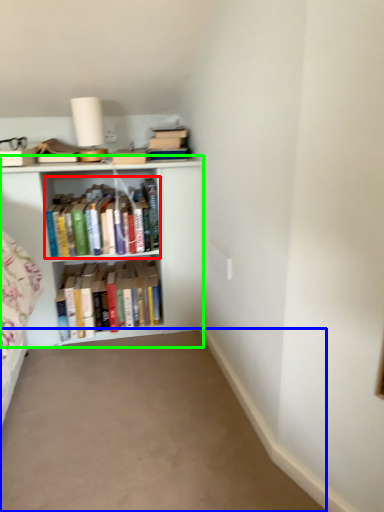
Question: Which object is positioned farthest from book (highlighted by a red box)? Select from plain (highlighted by a blue box) and shelf (highlighted by a green box).

Choices:
 (A) plain
 (B) shelf

Answer: (A)